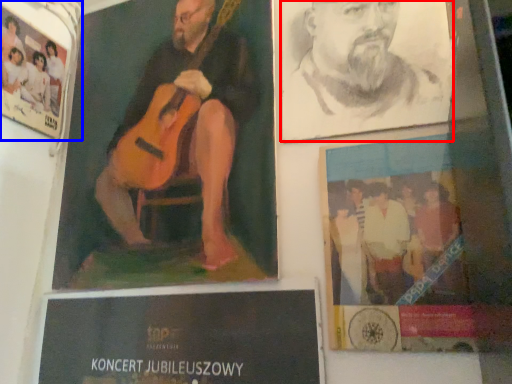
Question: Which of the following is the farthest to the observer, man (highlighted by a red box) or poster (highlighted by a blue box)?

Choices:
 (A) man
 (B) poster

Answer: (B)